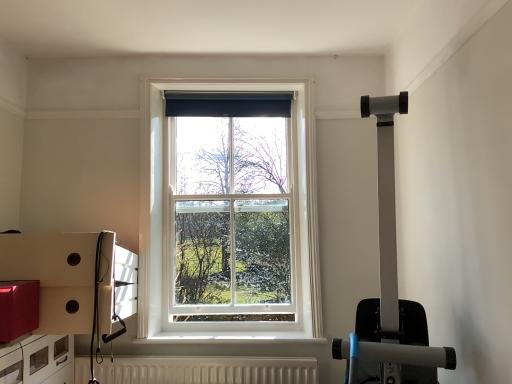
The height and width of the screenshot is (384, 512). Identify the location of white textured radiator at lower center. (207, 370).

This screenshot has width=512, height=384. Identify the location of white textured radiator at lower center. (207, 370).

Is white textured radiator at lower center oriented away from matte white drawer at lower left?

white textured radiator at lower center does not have its back to matte white drawer at lower left.

How different are the orientations of white textured radiator at lower center and matte white drawer at lower left in degrees?

92.3 degrees.

From the image's perspective, relative to matte white drawer at lower left, is white textured radiator at lower center above or below?

white textured radiator at lower center is below matte white drawer at lower left.

Considering the relative sizes of white textured radiator at lower center and matte white drawer at lower left in the image provided, is white textured radiator at lower center thinner than matte white drawer at lower left?

Yes, white textured radiator at lower center is thinner than matte white drawer at lower left.

From a real-world perspective, between white wooden window at center and white textured radiator at lower center, who is vertically lower?

From a 3D spatial view, white textured radiator at lower center is below.

Is white wooden window at center at the left side of white textured radiator at lower center?

In fact, white wooden window at center is to the right of white textured radiator at lower center.

What are the coordinates of `radiator to the left of white wooden window at center` in the screenshot? It's located at (207, 370).

From the image's perspective, relative to white wooden window at center, is matte white drawer at lower left above or below?

matte white drawer at lower left is below white wooden window at center.

Looking at this image, is matte white drawer at lower left positioned with its back to white wooden window at center?

No, matte white drawer at lower left's orientation is not away from white wooden window at center.

The image size is (512, 384). In order to click on drawer located underneath the white wooden window at center (from a real-world perspective) in this screenshot , I will do `click(38, 360)`.

Is white wooden window at center outside of matte white drawer at lower left?

white wooden window at center lies outside matte white drawer at lower left's area.

Between white wooden window at center and matte white drawer at lower left, which one has larger size?

matte white drawer at lower left.

Considering the relative positions of white wooden window at center and matte white drawer at lower left in the image provided, is white wooden window at center behind matte white drawer at lower left?

Yes, it is.

Is point (301, 87) positioned behind point (73, 378)?

That is True.

In the scene shown: How distant is matte white drawer at lower left from white textured radiator at lower center?

matte white drawer at lower left is 22.02 inches from white textured radiator at lower center.

Is matte white drawer at lower left facing away from white textured radiator at lower center?

No, matte white drawer at lower left is not facing the opposite direction of white textured radiator at lower center.

Considering their positions, is matte white drawer at lower left located in front of or behind white textured radiator at lower center?

Clearly, matte white drawer at lower left is in front of white textured radiator at lower center.

Considering the sizes of objects matte white drawer at lower left and white textured radiator at lower center in the image provided, who is smaller, matte white drawer at lower left or white textured radiator at lower center?

Smaller between the two is white textured radiator at lower center.

Does white textured radiator at lower center appear on the left side of white wooden window at center?

Answer: Indeed, white textured radiator at lower center is positioned on the left side of white wooden window at center.

How different are the orientations of white textured radiator at lower center and white wooden window at center in degrees?

0.756 degrees.

From a real-world perspective, is white textured radiator at lower center beneath white wooden window at center?

Indeed, from a real-world perspective, white textured radiator at lower center is positioned beneath white wooden window at center.

Is white textured radiator at lower center bigger than white wooden window at center?

Actually, white textured radiator at lower center might be smaller than white wooden window at center.

Image resolution: width=512 pixels, height=384 pixels. In order to click on drawer in front of the white textured radiator at lower center in this screenshot , I will do `click(38, 360)`.

Where is `window behind the white textured radiator at lower center`? Image resolution: width=512 pixels, height=384 pixels. window behind the white textured radiator at lower center is located at coordinates (173, 214).

When comparing their distances from white wooden window at center, does white textured radiator at lower center or matte white drawer at lower left seem further?

matte white drawer at lower left is further to white wooden window at center.

Consider the image. Looking at the image, which one is located closer to white textured radiator at lower center, white wooden window at center or matte white drawer at lower left?

Among the two, matte white drawer at lower left is located nearer to white textured radiator at lower center.

Looking at the image, which one is located closer to matte white drawer at lower left, white textured radiator at lower center or white wooden window at center?

Based on the image, white textured radiator at lower center appears to be nearer to matte white drawer at lower left.

From the image, which object appears to be nearer to white wooden window at center, matte white drawer at lower left or white textured radiator at lower center?

white textured radiator at lower center lies closer to white wooden window at center than the other object.

Considering their positions, is white wooden window at center positioned closer to matte white drawer at lower left than white textured radiator at lower center?

white textured radiator at lower center is closer to matte white drawer at lower left.

From the image, which object appears to be nearer to white textured radiator at lower center, matte white drawer at lower left or white wooden window at center?

The object closer to white textured radiator at lower center is matte white drawer at lower left.

Identify the location of radiator between matte white drawer at lower left and white wooden window at center in the horizontal direction. The image size is (512, 384). (207, 370).